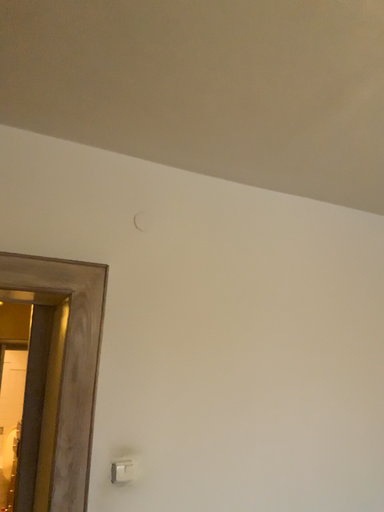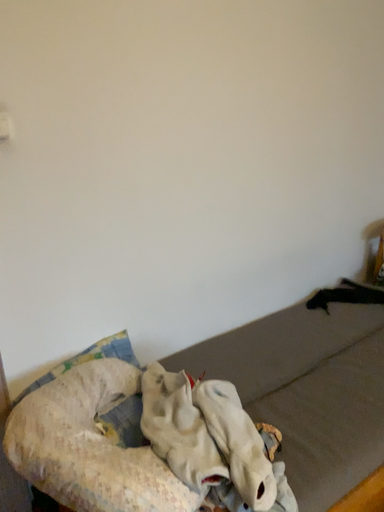
Question: How did the camera likely rotate when shooting the video?

Choices:
 (A) rotated left
 (B) rotated right

Answer: (B)